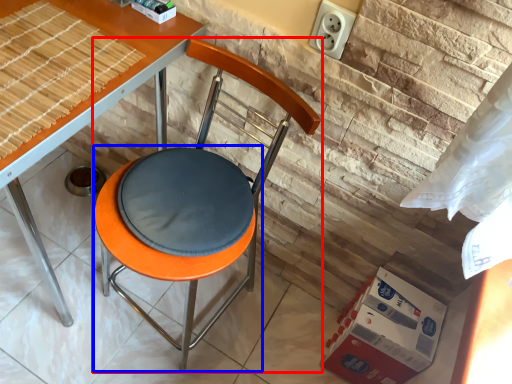
Question: Among these objects, which one is farthest to the camera, chair (highlighted by a red box) or bar stool (highlighted by a blue box)?

Choices:
 (A) chair
 (B) bar stool

Answer: (B)